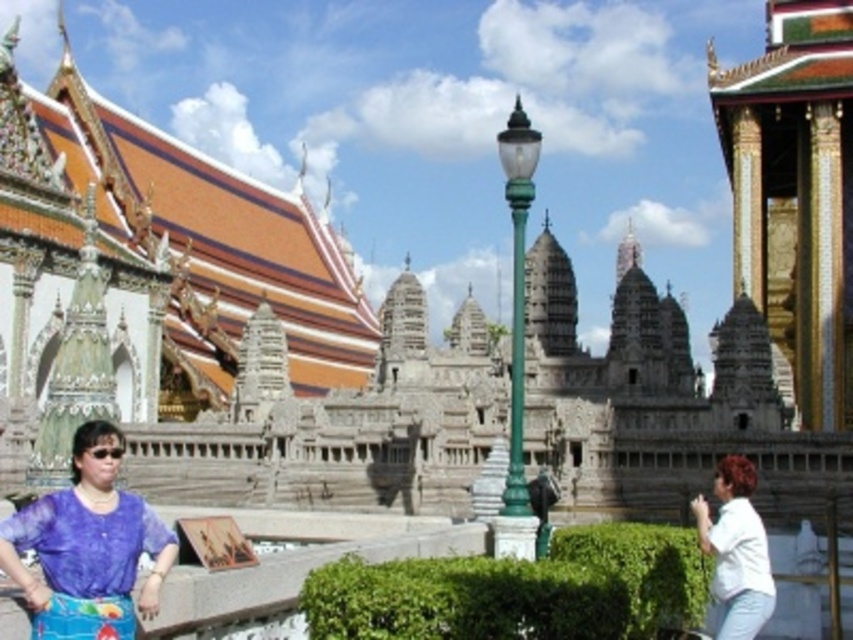
Looking at this image, you are standing in front of the miniature Angkor Wat model and want to reach a specific point marked at coordinates point (77,513). If your walking distance is limited to 30 meters, can you reach that point without moving further away?

The point (77,513) is 34.53 meters away from the viewer, which exceeds your walking distance limit of 30 meters. Therefore, you cannot reach that point without moving further away.

You are standing at the point with coordinates (x=88, y=541) in the image. Based on the scene described, what object is located at this position?

The point at coordinates (x=88, y=541) corresponds to the purple sheer blouse at lower left.

You are a photographer planning to capture a symmetrical shot of the two people in the scene. Given that the purple sheer blouse at lower left and the white matte shirt at lower right are part of your composition, which person should you adjust to ensure both appear equally sized in the photo?

Since the purple sheer blouse at lower left is wider than the white matte shirt at lower right, you should move the person wearing the purple sheer blouse at lower left further away from the camera to reduce its apparent size, making both appear equally sized in the photo.